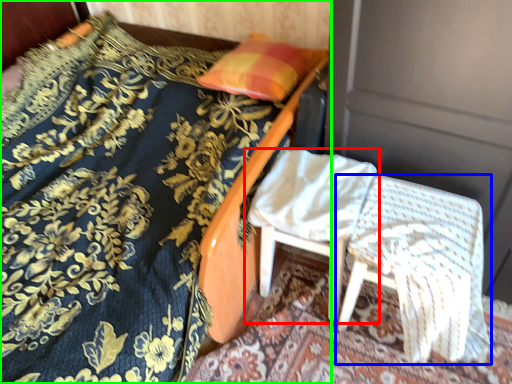
Question: Estimate the real-world distances between objects in this image. Which object is closer to chair (highlighted by a red box), chair (highlighted by a blue box) or bed (highlighted by a green box)?

Choices:
 (A) chair
 (B) bed

Answer: (A)